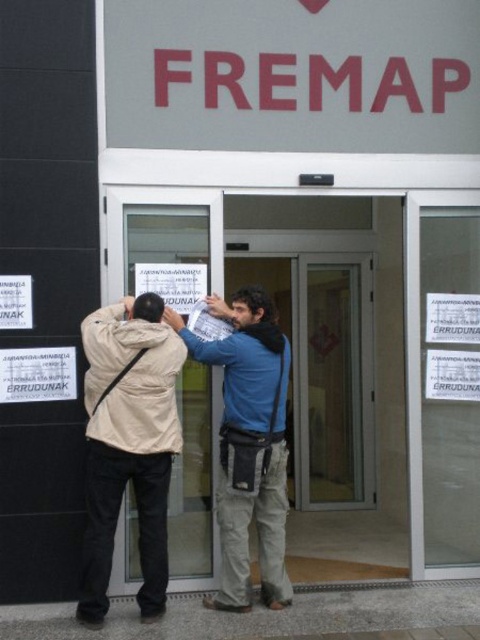
Can you confirm if beige fabric jacket at center is smaller than beige fabric jacket at left?

Actually, beige fabric jacket at center might be larger than beige fabric jacket at left.

Does beige fabric jacket at center appear on the right side of beige fabric jacket at left?

Yes, beige fabric jacket at center is to the right of beige fabric jacket at left.

Which is behind, point (91, 321) or point (123, 392)?

The point (91, 321) is behind.

Locate an element on the screen. beige fabric jacket at center is located at coordinates (159, 422).

Can you confirm if red plastic sign at upper center is bigger than beige fabric jacket at center?

Incorrect, red plastic sign at upper center is not larger than beige fabric jacket at center.

Measure the distance between red plastic sign at upper center and camera.

A distance of 5.17 meters exists between red plastic sign at upper center and camera.

Between point (109, 77) and point (158, 456), which one is positioned behind?

Point (109, 77)

The width and height of the screenshot is (480, 640). I want to click on red plastic sign at upper center, so click(292, 74).

Does point (324, 83) come farther from viewer compared to point (144, 324)?

Yes, it is behind point (144, 324).

Is red plastic sign at upper center wider than beige fabric jacket at left?

Yes, red plastic sign at upper center is wider than beige fabric jacket at left.

Between point (195, 81) and point (106, 480), which one is positioned in front?

Positioned in front is point (106, 480).

Identify the location of red plastic sign at upper center. (292, 74).